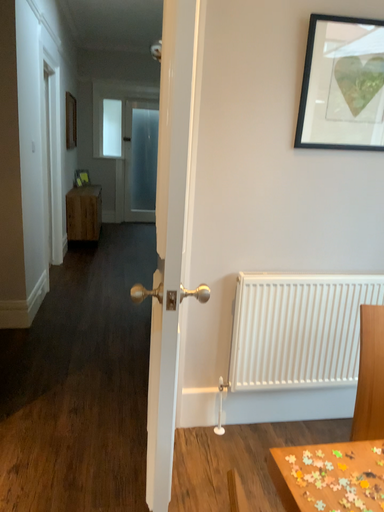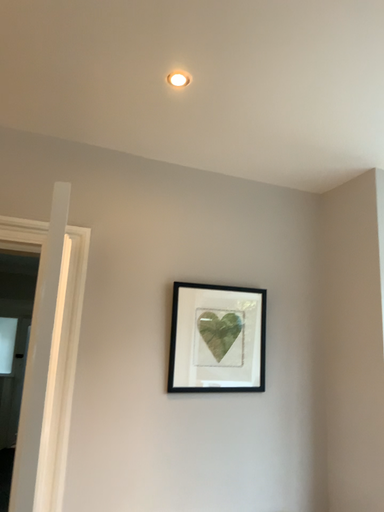
Question: How did the camera likely rotate when shooting the video?

Choices:
 (A) rotated right
 (B) rotated left

Answer: (A)